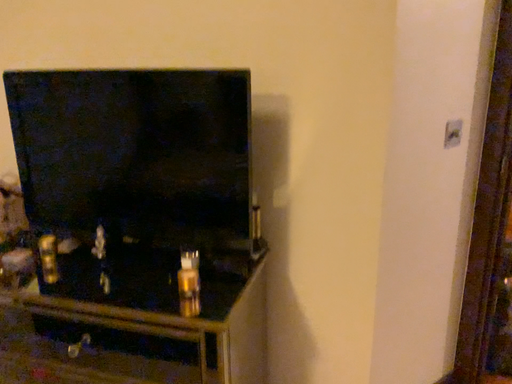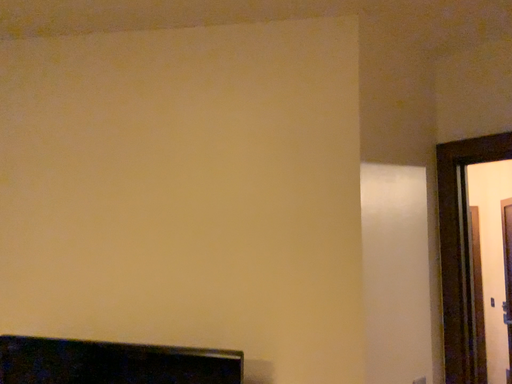
Question: Which way did the camera rotate in the video?

Choices:
 (A) rotated upward
 (B) rotated downward

Answer: (A)